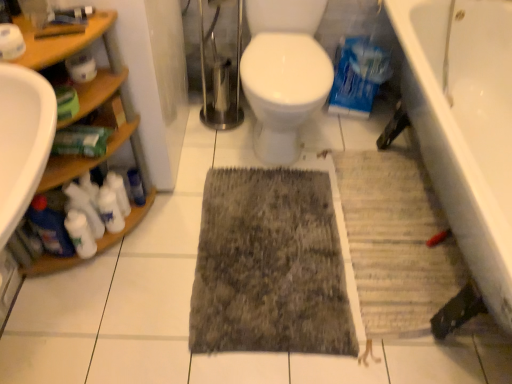
The height and width of the screenshot is (384, 512). Find the location of `free space between blue glossy bottle at left, the 4th cleaning product viewed from the right, and gray textured bath mat at lower right`. free space between blue glossy bottle at left, the 4th cleaning product viewed from the right, and gray textured bath mat at lower right is located at coordinates (248, 243).